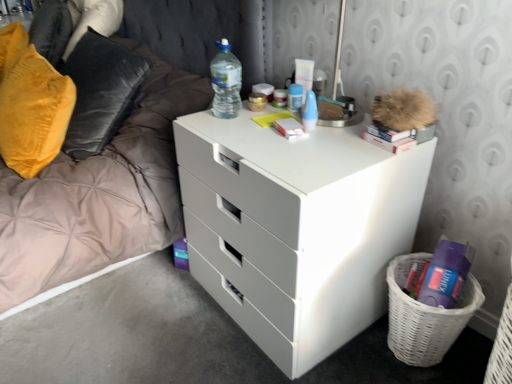
Question: Considering the relative sizes of white matte chest of drawers at center and translucent plastic water bottle at upper center in the image provided, is white matte chest of drawers at center shorter than translucent plastic water bottle at upper center?

Choices:
 (A) no
 (B) yes

Answer: (A)

Question: From the image's perspective, is white matte chest of drawers at center under translucent plastic water bottle at upper center?

Choices:
 (A) no
 (B) yes

Answer: (B)

Question: Does white matte chest of drawers at center have a lesser width compared to translucent plastic water bottle at upper center?

Choices:
 (A) yes
 (B) no

Answer: (B)

Question: Is white matte chest of drawers at center not near translucent plastic water bottle at upper center?

Choices:
 (A) no
 (B) yes

Answer: (A)

Question: Is white matte chest of drawers at center oriented towards translucent plastic water bottle at upper center?

Choices:
 (A) no
 (B) yes

Answer: (A)

Question: Considering the relative sizes of white matte chest of drawers at center and translucent plastic water bottle at upper center in the image provided, is white matte chest of drawers at center wider than translucent plastic water bottle at upper center?

Choices:
 (A) yes
 (B) no

Answer: (A)

Question: From the image's perspective, is velvet yellow pillow at left located beneath white glossy bed frame at left?

Choices:
 (A) yes
 (B) no

Answer: (A)

Question: Is velvet yellow pillow at left oriented towards white glossy bed frame at left?

Choices:
 (A) yes
 (B) no

Answer: (A)

Question: Considering the relative sizes of velvet yellow pillow at left and white glossy bed frame at left in the image provided, is velvet yellow pillow at left smaller than white glossy bed frame at left?

Choices:
 (A) no
 (B) yes

Answer: (B)

Question: Is velvet yellow pillow at left closer to the viewer compared to white glossy bed frame at left?

Choices:
 (A) no
 (B) yes

Answer: (A)

Question: Is velvet yellow pillow at left turned away from white glossy bed frame at left?

Choices:
 (A) no
 (B) yes

Answer: (B)

Question: From a real-world perspective, is velvet yellow pillow at left located higher than white glossy bed frame at left?

Choices:
 (A) no
 (B) yes

Answer: (B)

Question: From the image's perspective, does white matte book at center, which ranks as the second book in right-to-left order, appear lower than velvet yellow pillow at left?

Choices:
 (A) yes
 (B) no

Answer: (A)